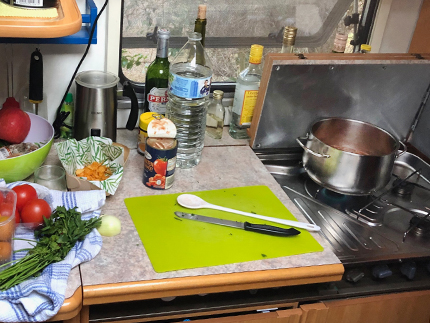
Locate an element on the screen. Image resolution: width=430 pixels, height=323 pixels. spoon is located at coordinates (201, 197).